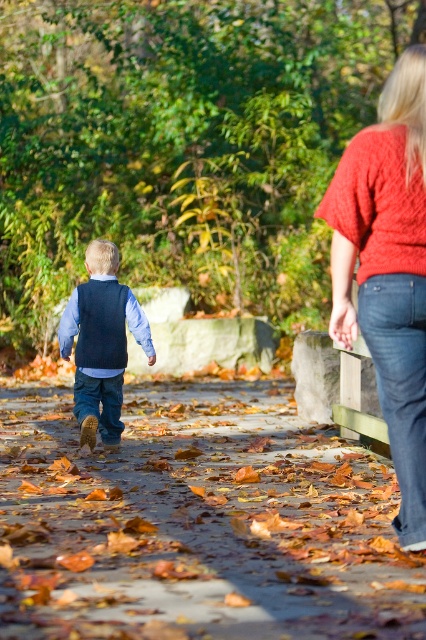
Describe the element at coordinates (198, 522) in the screenshot. The image size is (426, 640). I see `leaves carpeted path at center` at that location.

Between leaves carpeted path at center and knitted red sweater at upper right, which one has less height?

Standing shorter between the two is leaves carpeted path at center.

I want to click on leaves carpeted path at center, so click(198, 522).

This screenshot has height=640, width=426. What are the coordinates of `leaves carpeted path at center` in the screenshot? It's located at (198, 522).

Is point (394, 522) positioned before point (117, 445)?

Yes, it is.

Between point (333, 262) and point (94, 404), which one is positioned in front?

Point (333, 262) is more forward.

Does point (417, 401) lie in front of point (95, 330)?

Yes, point (417, 401) is closer to viewer.

You are a GUI agent. You are given a task and a screenshot of the screen. Output one action in this format:
    pyautogui.click(x=<x>, y=<y>)
    Task: Click on the knitted red sweater at upper right
    The image size is (426, 640).
    Given the screenshot: What is the action you would take?
    pyautogui.click(x=388, y=269)

Can you confirm if leaves carpeted path at center is positioned below denim vest at center?

Correct, leaves carpeted path at center is located below denim vest at center.

Does point (103, 481) come in front of point (115, 292)?

Yes, point (103, 481) is closer to viewer.

Image resolution: width=426 pixels, height=640 pixels. I want to click on leaves carpeted path at center, so click(x=198, y=522).